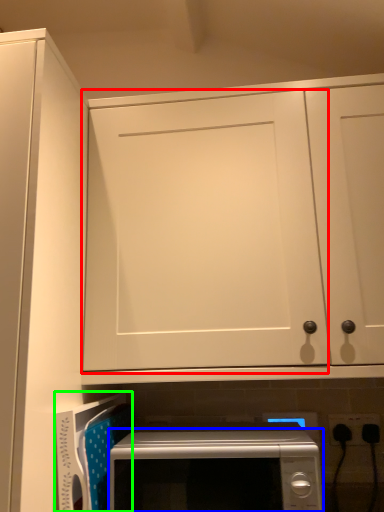
Question: Considering the real-world distances, which object is closest to door (highlighted by a red box)? microwave oven (highlighted by a blue box) or appliance (highlighted by a green box).

Choices:
 (A) microwave oven
 (B) appliance

Answer: (A)